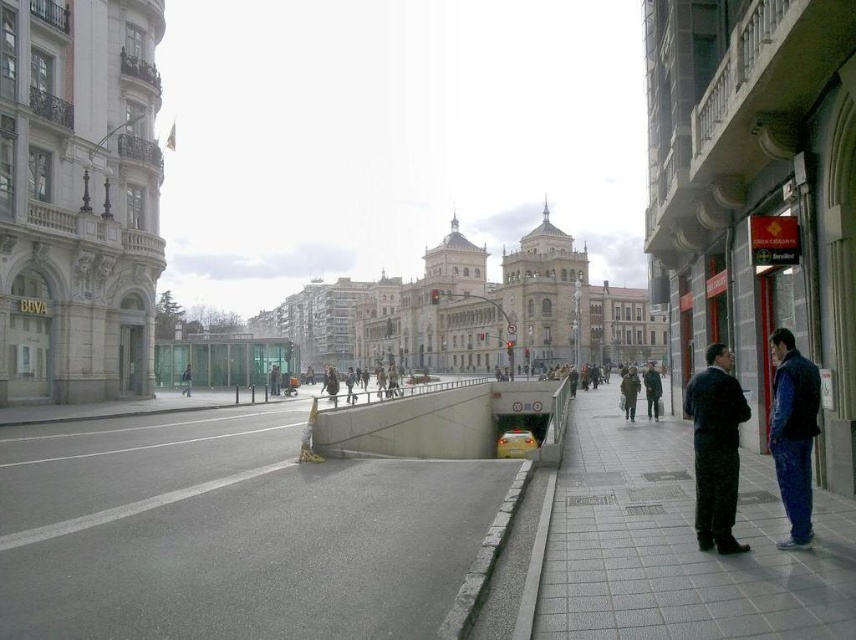
Question: Which point is closer to the camera taking this photo?

Choices:
 (A) (183, 372)
 (B) (627, 410)
 (C) (393, 540)

Answer: (C)

Question: Is gray concrete curb at lower center above dark blue jeans at center?

Choices:
 (A) yes
 (B) no

Answer: (B)

Question: Does dark blue fabric coat at right appear over green fabric coat at lower right?

Choices:
 (A) no
 (B) yes

Answer: (B)

Question: Does gray tile pavement at lower right come in front of dark green jacket at lower right?

Choices:
 (A) yes
 (B) no

Answer: (A)

Question: Which point is closer to the camera?

Choices:
 (A) gray concrete pavement at center
 (B) dark green jacket at lower right
 (C) blue fleece jacket at right

Answer: (A)

Question: Among these objects, which one is farthest from the camera?

Choices:
 (A) blue fleece jacket at right
 (B) gray concrete pavement at center

Answer: (A)